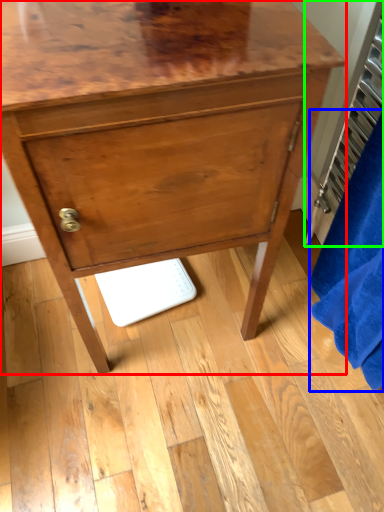
Question: Considering the real-world distances, which object is closest to chest of drawers (highlighted by a red box)? bath towel (highlighted by a blue box) or radiator (highlighted by a green box).

Choices:
 (A) bath towel
 (B) radiator

Answer: (A)